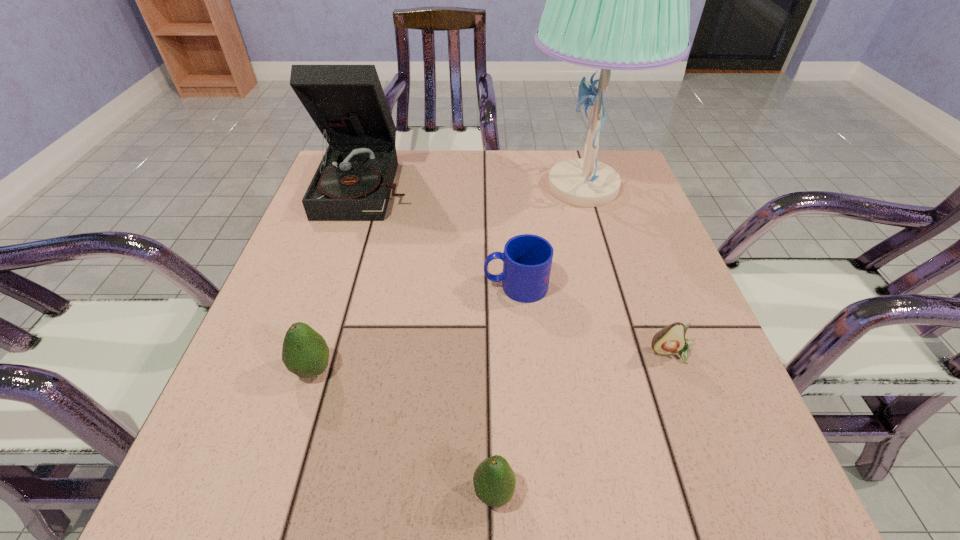
The width and height of the screenshot is (960, 540). Find the location of `free spot between the third farthest object and the second tallest object`. free spot between the third farthest object and the second tallest object is located at coordinates (442, 236).

Locate an element on the screen. Image resolution: width=960 pixels, height=540 pixels. free space between the lamp and the leftmost avocado is located at coordinates (448, 278).

Locate an element on the screen. The height and width of the screenshot is (540, 960). free space between the leftmost avocado and the fourth nearest object is located at coordinates (415, 327).

Where is `unoccupied position between the tallest avocado and the tallest object`? unoccupied position between the tallest avocado and the tallest object is located at coordinates (448, 278).

I want to click on free spot between the nearest object and the rightmost avocado, so click(583, 423).

You are a GUI agent. You are given a task and a screenshot of the screen. Output one action in this format:
    pyautogui.click(x=<x>, y=<y>)
    Task: Click on the blank region between the tallest avocado and the tallest object
    
    Given the screenshot: What is the action you would take?
    pyautogui.click(x=448, y=278)

Find the location of a particular element. The image size is (960, 540). vacant space that's between the second avocado from right to left and the leftmost avocado is located at coordinates (403, 430).

You are a GUI agent. You are given a task and a screenshot of the screen. Output one action in this format:
    pyautogui.click(x=<x>, y=<y>)
    Task: Click on the empty space between the tallest avocado and the rightmost avocado
    This screenshot has width=960, height=540.
    Given the screenshot: What is the action you would take?
    pyautogui.click(x=492, y=361)

Where is `object that stands as the fourth closest to the fifth shortest object`? Image resolution: width=960 pixels, height=540 pixels. object that stands as the fourth closest to the fifth shortest object is located at coordinates (671, 339).

Choose which object is the second nearest neighbor to the fifth shortest object. Please provide its 2D coordinates. Your answer should be formatted as a tuple, i.e. [(x, y)], where the tuple contains the x and y coordinates of a point satisfying the conditions above.

[(616, 0)]